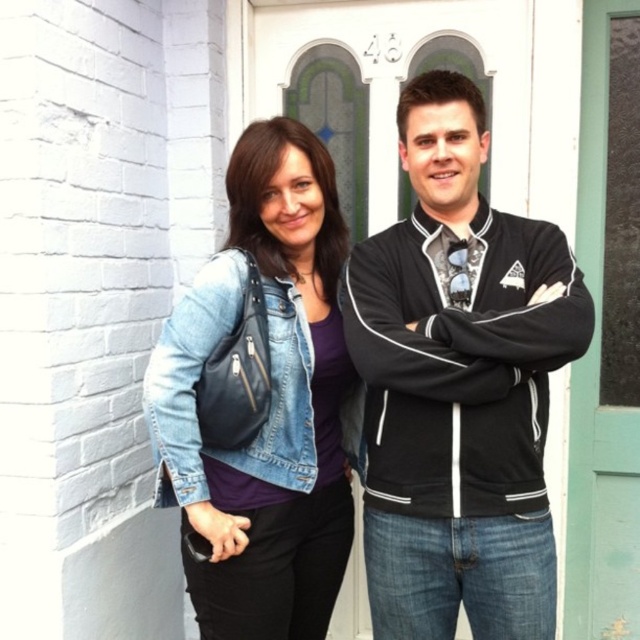
You are standing in front of the building with the white door and green window frame. You see a point marked at coordinate (458, 385). What object is located at that point?

The point at coordinate (458, 385) indicates the location of the black fleece jacket at right.

You are a photographer trying to capture a photo of the two people standing in front of the building. You want to ensure that both the black fleece jacket at right and the denim jacket at center are clearly visible in the frame. Based on their positions, which jacket is closer to the right edge of the photo?

The black fleece jacket at right is to the right of the denim jacket at center, so the black fleece jacket at right is closer to the right edge of the photo.